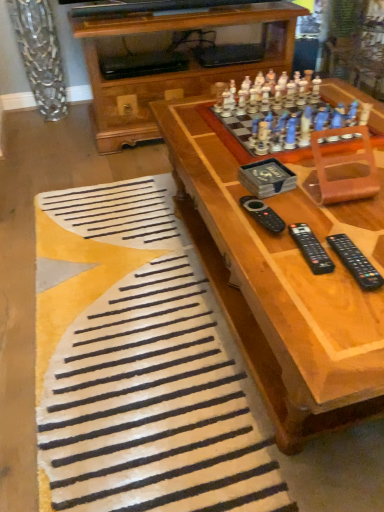
Find the location of a particular element. Image resolution: width=384 pixels, height=512 pixels. vacant space in between black plastic remote at lower right, which ranks as the second remote in left-to-right order, and black plastic remote at center, which is counted as the 1th remote, starting from the left is located at coordinates (284, 234).